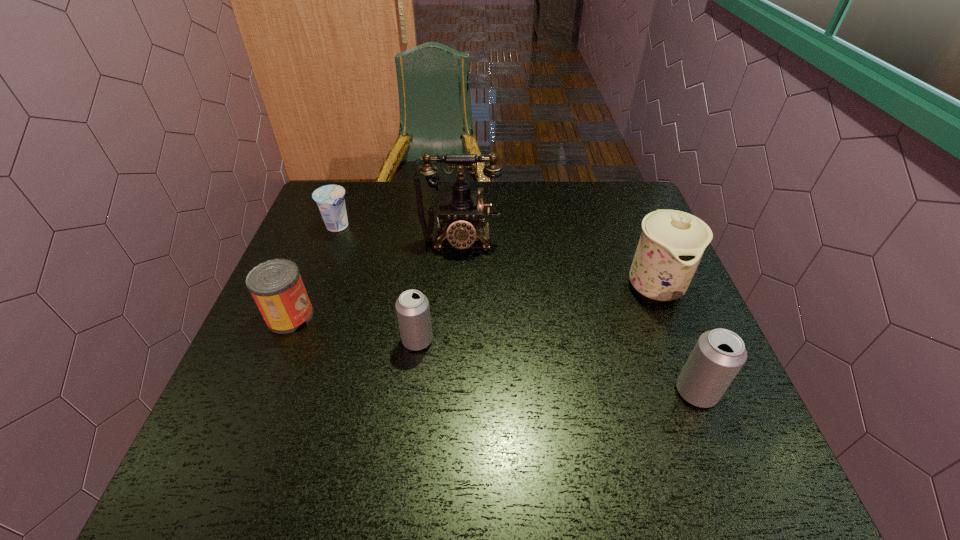
I want to click on chinaware present at the right edge, so click(671, 245).

Identify the location of object that is at the far left corner. The width and height of the screenshot is (960, 540). (330, 199).

I want to click on object at the near right corner, so click(x=719, y=354).

Find the location of a particular element. The width and height of the screenshot is (960, 540). free region at the far edge of the desktop is located at coordinates (488, 192).

The width and height of the screenshot is (960, 540). In the image, there is a desktop. In order to click on free region at the near edge in this screenshot , I will do `click(479, 413)`.

This screenshot has height=540, width=960. In the image, there is a desktop. Find the location of `vacant space at the left edge`. vacant space at the left edge is located at coordinates (334, 287).

Identify the location of free spot at the right edge of the desktop. (643, 320).

Image resolution: width=960 pixels, height=540 pixels. Find the location of `free spot at the far left corner of the desktop`. free spot at the far left corner of the desktop is located at coordinates tap(356, 204).

The height and width of the screenshot is (540, 960). I want to click on free space at the near left corner of the desktop, so point(221,416).

Image resolution: width=960 pixels, height=540 pixels. I want to click on unoccupied area between the second tallest object and the can, so click(472, 300).